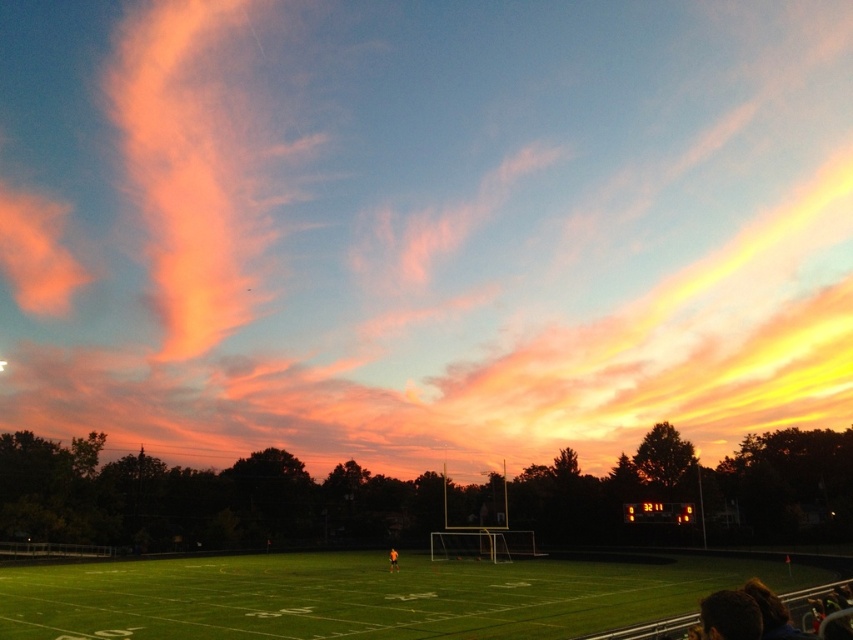
Is pink cotton candy cloud at upper center wider than orange fabric person at center?

Yes.

This screenshot has height=640, width=853. I want to click on pink cotton candy cloud at upper center, so click(x=424, y=225).

Describe the element at coordinates (424, 225) in the screenshot. I see `pink cotton candy cloud at upper center` at that location.

Between pink cotton candy cloud at upper center and green artificial turf at center, which one is positioned higher?

pink cotton candy cloud at upper center is higher up.

Find the location of a particular element. pink cotton candy cloud at upper center is located at coordinates (424, 225).

Does green artificial turf at center have a greater height compared to orange fabric person at center?

Correct, green artificial turf at center is much taller as orange fabric person at center.

Can you confirm if green artificial turf at center is wider than orange fabric person at center?

Correct, the width of green artificial turf at center exceeds that of orange fabric person at center.

Which is behind, point (105, 627) or point (396, 556)?

The point (396, 556) is more distant.

The width and height of the screenshot is (853, 640). Find the location of `green artificial turf at center`. green artificial turf at center is located at coordinates (363, 596).